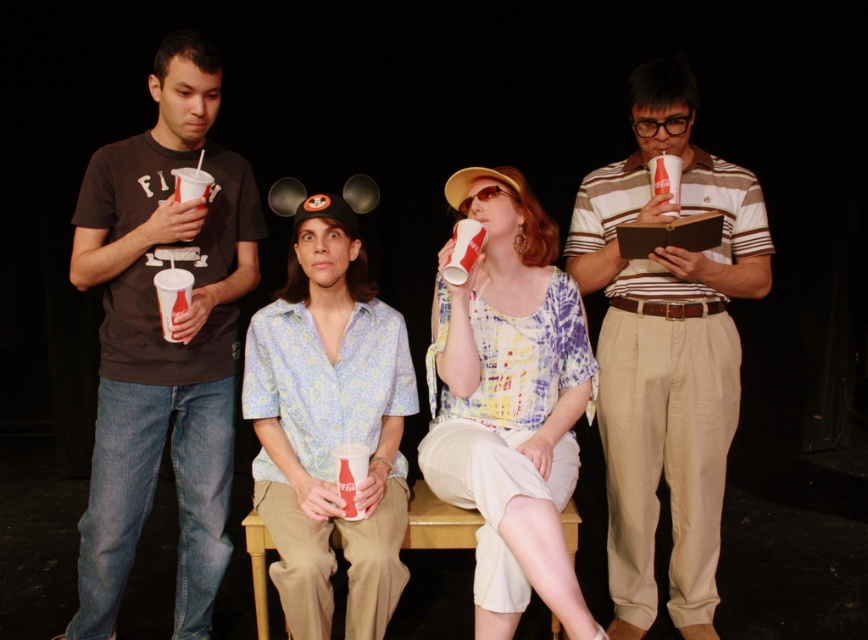
Looking at this image, you are a photographer positioned at the front of the stage. You notice two points of interest marked as point (x=125, y=200) and point (x=181, y=276) in the image. Which point is closer to your camera?

Point (x=125, y=200) is further to the camera than point (x=181, y=276), so the point closer to the camera is point (x=181, y=276).